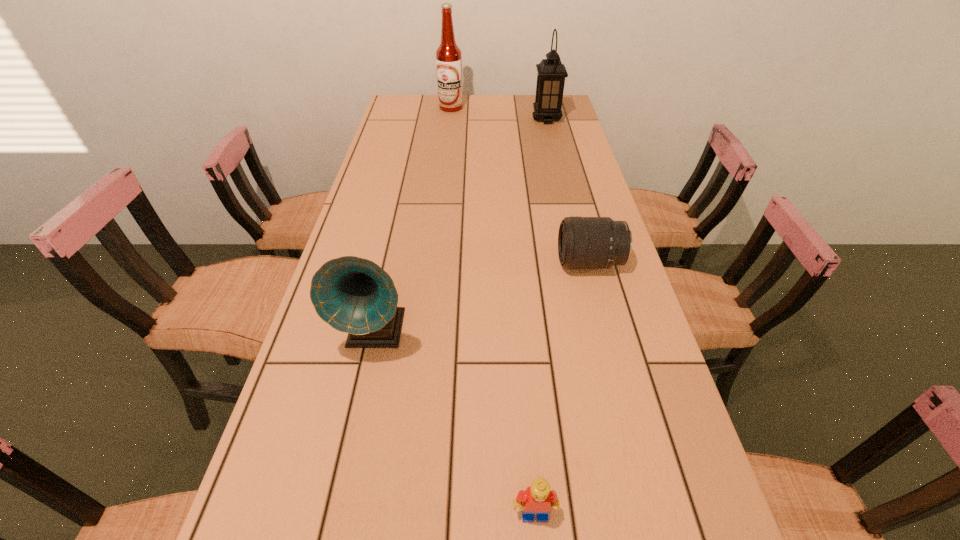
Locate an element on the screen. This screenshot has height=540, width=960. empty space that is in between the third nearest object and the nearest object is located at coordinates (563, 388).

Locate an element on the screen. empty location between the nearest object and the third tallest object is located at coordinates (455, 423).

The height and width of the screenshot is (540, 960). Identify the location of free space between the third shortest object and the fourth shortest object. (461, 226).

Select which object appears as the fourth closest to the telephoto lens. Please provide its 2D coordinates. Your answer should be formatted as a tuple, i.e. [(x, y)], where the tuple contains the x and y coordinates of a point satisfying the conditions above.

[(448, 55)]

Find the location of a particular element. the third closest object to the second nearest object is located at coordinates (551, 74).

Image resolution: width=960 pixels, height=540 pixels. Identify the location of vacant space that satisfies the following two spatial constraints: 1. on the surface of the third nearest object; 2. from the horn of the phonograph_record. (609, 332).